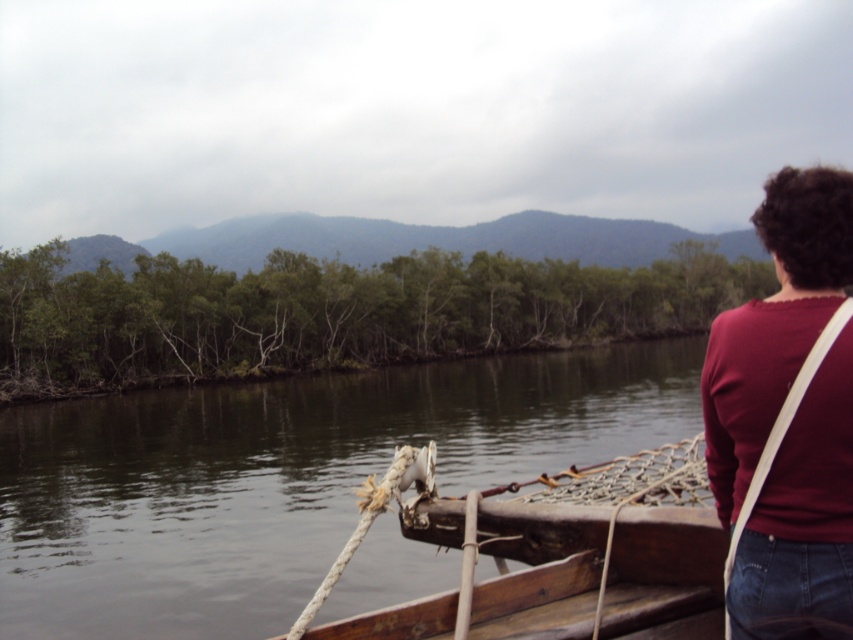
Consider the image. Does maroon fabric shirt at upper right have a greater width compared to wooden boat at center?

Correct, the width of maroon fabric shirt at upper right exceeds that of wooden boat at center.

Locate an element on the screen. maroon fabric shirt at upper right is located at coordinates (775, 323).

What do you see at coordinates (283, 477) in the screenshot? I see `brown wooden boat at center` at bounding box center [283, 477].

Consider the image. Does brown wooden boat at center have a lesser width compared to wooden boat at center?

Incorrect, brown wooden boat at center's width is not less than wooden boat at center's.

You are a GUI agent. You are given a task and a screenshot of the screen. Output one action in this format:
    pyautogui.click(x=<x>, y=<y>)
    Task: Click on the brown wooden boat at center
    Image resolution: width=853 pixels, height=640 pixels.
    Given the screenshot: What is the action you would take?
    pyautogui.click(x=283, y=477)

Which of these two, brown wooden boat at center or maroon fabric shirt at upper right, stands taller?

brown wooden boat at center is taller.

Between brown wooden boat at center and maroon fabric shirt at upper right, which one has less height?

Standing shorter between the two is maroon fabric shirt at upper right.

The height and width of the screenshot is (640, 853). I want to click on brown wooden boat at center, so click(283, 477).